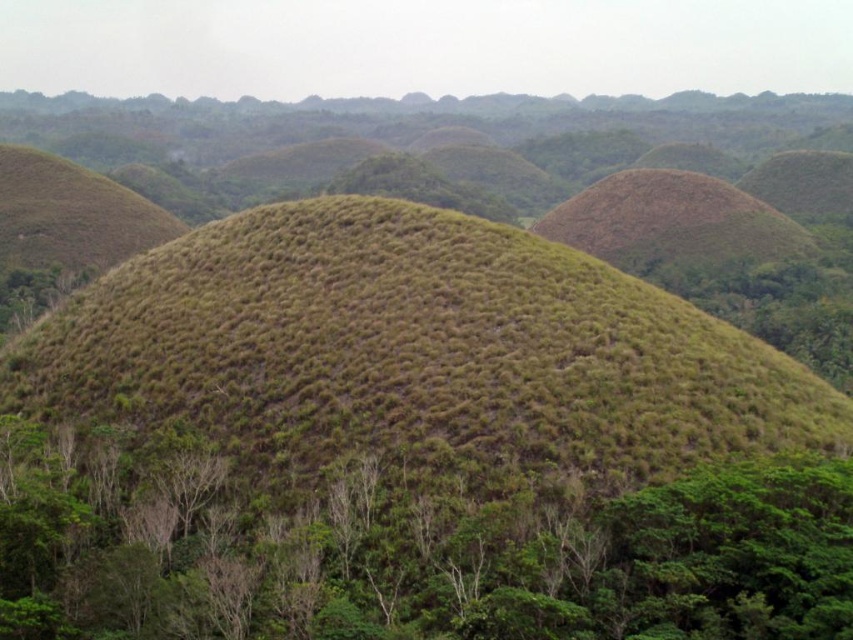
Is green leafy tree at center wider than brown grassy mound at upper right?

In fact, green leafy tree at center might be narrower than brown grassy mound at upper right.

Who is shorter, green leafy tree at center or brown grassy mound at upper right?

green leafy tree at center is shorter.

Which is in front, point (192, 564) or point (648, 195)?

Point (192, 564) is in front.

You are a GUI agent. You are given a task and a screenshot of the screen. Output one action in this format:
    pyautogui.click(x=<x>, y=<y>)
    Task: Click on the green leafy tree at center
    This screenshot has width=853, height=640.
    Given the screenshot: What is the action you would take?
    pyautogui.click(x=408, y=547)